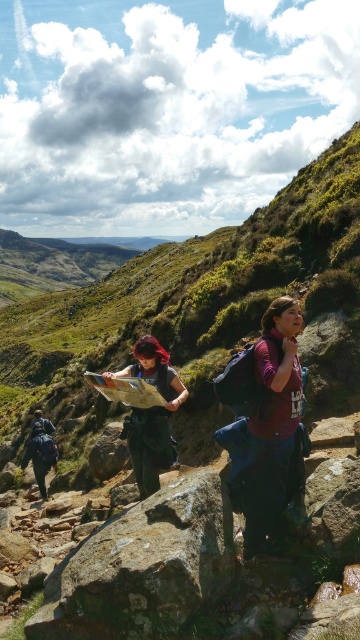
Locate an element on the screen. green mossy rock at center is located at coordinates (144, 566).

How much distance is there between green mossy rock at center and dark blue fabric map at center?

green mossy rock at center and dark blue fabric map at center are 4.65 meters apart from each other.

Find the location of a particular element. green mossy rock at center is located at coordinates (144, 566).

Does point (138, 481) come closer to viewer compared to point (38, 422)?

That is True.

What do you see at coordinates (150, 413) in the screenshot? I see `dark blue fabric map at center` at bounding box center [150, 413].

Where is `dark blue fabric map at center`? dark blue fabric map at center is located at coordinates (150, 413).

Consider the image. Between green mossy rock at center and dark blue backpack at lower left, which one appears on the right side from the viewer's perspective?

green mossy rock at center

Which is in front, point (210, 592) or point (36, 460)?

Point (210, 592)

Between point (172, 573) and point (42, 433), which one is positioned behind?

The point (42, 433) is behind.

At what (x,y) coordinates should I click in order to perform the action: click on green mossy rock at center. Please return your answer as a coordinate pair (x, y). The height and width of the screenshot is (640, 360). Looking at the image, I should click on (144, 566).